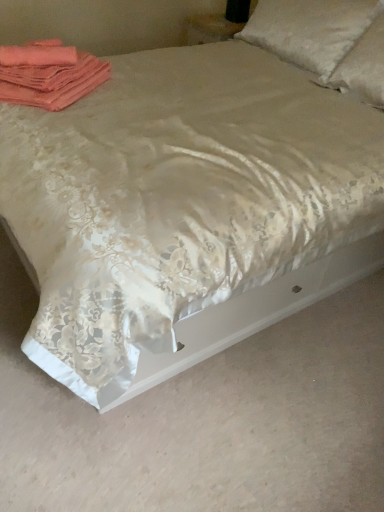
Locate an element on the screen. Image resolution: width=384 pixels, height=512 pixels. white satin pillow at upper right, which is the first pillow in left-to-right order is located at coordinates (310, 30).

In order to click on coral fabric towels at upper left in this screenshot , I will do `click(48, 74)`.

Is satin white pillow at upper right, the first pillow in the right-to-left sequence, positioned with its back to white satin pillow at upper right, which is the first pillow in left-to-right order?

No, white satin pillow at upper right, which is the first pillow in left-to-right order, is not at the back of satin white pillow at upper right, the first pillow in the right-to-left sequence.

From the image's perspective, does satin white pillow at upper right, the 2th pillow from the left, appear lower than white satin pillow at upper right, which is the first pillow in left-to-right order?

Indeed, from the image's perspective, satin white pillow at upper right, the 2th pillow from the left, is shown beneath white satin pillow at upper right, which is the first pillow in left-to-right order.

Is point (352, 89) in front of point (327, 9)?

Yes, it is in front of point (327, 9).

Does satin white pillow at upper right, the 2th pillow from the left, have a greater width compared to white satin pillow at upper right, which is the first pillow in left-to-right order?

Indeed, satin white pillow at upper right, the 2th pillow from the left, has a greater width compared to white satin pillow at upper right, which is the first pillow in left-to-right order.

Between white satin pillow at upper right, the second pillow from the right, and coral fabric towels at upper left, which one appears on the left side from the viewer's perspective?

coral fabric towels at upper left is more to the left.

Is white satin pillow at upper right, which is the first pillow in left-to-right order, located outside coral fabric towels at upper left?

Indeed, white satin pillow at upper right, which is the first pillow in left-to-right order, is completely outside coral fabric towels at upper left.

Looking at this image, who is taller, white satin pillow at upper right, which is the first pillow in left-to-right order, or coral fabric towels at upper left?

Standing taller between the two is white satin pillow at upper right, which is the first pillow in left-to-right order.

Is white satin pillow at upper right, which is the first pillow in left-to-right order, touching coral fabric towels at upper left?

white satin pillow at upper right, which is the first pillow in left-to-right order, and coral fabric towels at upper left are clearly separated.

How many degrees apart are the facing directions of coral fabric towels at upper left and white satin pillow at upper right, which is the first pillow in left-to-right order?

They differ by 52 degrees in their facing directions.

Which is behind, coral fabric towels at upper left or white satin pillow at upper right, which is the first pillow in left-to-right order?

Positioned behind is white satin pillow at upper right, which is the first pillow in left-to-right order.

From the image's perspective, would you say coral fabric towels at upper left is shown under white satin pillow at upper right, which is the first pillow in left-to-right order?

Yes, from the image's perspective, coral fabric towels at upper left is below white satin pillow at upper right, which is the first pillow in left-to-right order.

Is point (20, 65) behind point (289, 53)?

No, (20, 65) is in front of (289, 53).

At what (x,y) coordinates should I click in order to perform the action: click on pillow that is above the satin white pillow at upper right, the first pillow in the right-to-left sequence (from the image's perspective). Please return your answer as a coordinate pair (x, y). Looking at the image, I should click on (310, 30).

Is white satin pillow at upper right, which is the first pillow in left-to-right order, oriented away from satin white pillow at upper right, the 2th pillow from the left?

No.

Could satin white pillow at upper right, the first pillow in the right-to-left sequence, be considered to be inside white satin pillow at upper right, which is the first pillow in left-to-right order?

Yes.

Considering the relative sizes of white satin pillow at upper right, which is the first pillow in left-to-right order, and satin white pillow at upper right, the 2th pillow from the left, in the image provided, is white satin pillow at upper right, which is the first pillow in left-to-right order, taller than satin white pillow at upper right, the 2th pillow from the left,?

No, white satin pillow at upper right, which is the first pillow in left-to-right order, is not taller than satin white pillow at upper right, the 2th pillow from the left.

How many degrees apart are the facing directions of satin white pillow at upper right, the 2th pillow from the left, and coral fabric towels at upper left?

satin white pillow at upper right, the 2th pillow from the left, and coral fabric towels at upper left are facing 52 degrees away from each other.

In the scene shown: Which object is wider, satin white pillow at upper right, the 2th pillow from the left, or coral fabric towels at upper left?

With larger width is satin white pillow at upper right, the 2th pillow from the left.

Which object is closer to the camera taking this photo, satin white pillow at upper right, the first pillow in the right-to-left sequence, or coral fabric towels at upper left?

coral fabric towels at upper left is closer to the camera.

Is satin white pillow at upper right, the first pillow in the right-to-left sequence, aimed at coral fabric towels at upper left?

Yes, satin white pillow at upper right, the first pillow in the right-to-left sequence, is turned towards coral fabric towels at upper left.

Which point is more forward, (99, 74) or (369, 32)?

The point (99, 74) is in front.

Is coral fabric towels at upper left in front of or behind satin white pillow at upper right, the first pillow in the right-to-left sequence, in the image?

Clearly, coral fabric towels at upper left is in front of satin white pillow at upper right, the first pillow in the right-to-left sequence.

Would you say coral fabric towels at upper left is a long distance from satin white pillow at upper right, the 2th pillow from the left?

Yes, coral fabric towels at upper left and satin white pillow at upper right, the 2th pillow from the left, are quite far apart.

Find the location of `pillow above the white satin pillow at upper right, which is the first pillow in left-to-right order (from a real-world perspective)`. pillow above the white satin pillow at upper right, which is the first pillow in left-to-right order (from a real-world perspective) is located at coordinates (363, 66).

You are a GUI agent. You are given a task and a screenshot of the screen. Output one action in this format:
    pyautogui.click(x=<x>, y=<y>)
    Task: Click on the material located on the left of white satin pillow at upper right, the second pillow from the right
    
    Given the screenshot: What is the action you would take?
    pyautogui.click(x=48, y=74)

Looking at the image, which one is located closer to coral fabric towels at upper left, white satin pillow at upper right, the second pillow from the right, or satin white pillow at upper right, the first pillow in the right-to-left sequence?

white satin pillow at upper right, the second pillow from the right, lies closer to coral fabric towels at upper left than the other object.

In the scene shown: Looking at the image, which one is located closer to white satin pillow at upper right, which is the first pillow in left-to-right order, coral fabric towels at upper left or satin white pillow at upper right, the 2th pillow from the left?

satin white pillow at upper right, the 2th pillow from the left, is positioned closer to the anchor white satin pillow at upper right, which is the first pillow in left-to-right order.

Considering their positions, is coral fabric towels at upper left positioned further to satin white pillow at upper right, the first pillow in the right-to-left sequence, than white satin pillow at upper right, which is the first pillow in left-to-right order?

coral fabric towels at upper left is positioned further to the anchor satin white pillow at upper right, the first pillow in the right-to-left sequence.

When comparing their distances from satin white pillow at upper right, the first pillow in the right-to-left sequence, does white satin pillow at upper right, which is the first pillow in left-to-right order, or coral fabric towels at upper left seem closer?

white satin pillow at upper right, which is the first pillow in left-to-right order, lies closer to satin white pillow at upper right, the first pillow in the right-to-left sequence, than the other object.

Consider the image. Which object lies nearer to the anchor point coral fabric towels at upper left, satin white pillow at upper right, the 2th pillow from the left, or white satin pillow at upper right, which is the first pillow in left-to-right order?

white satin pillow at upper right, which is the first pillow in left-to-right order, is closer to coral fabric towels at upper left.

From the image, which object appears to be nearer to white satin pillow at upper right, which is the first pillow in left-to-right order, satin white pillow at upper right, the first pillow in the right-to-left sequence, or coral fabric towels at upper left?

satin white pillow at upper right, the first pillow in the right-to-left sequence, lies closer to white satin pillow at upper right, which is the first pillow in left-to-right order, than the other object.

This screenshot has height=512, width=384. Find the location of `pillow between coral fabric towels at upper left and satin white pillow at upper right, the 2th pillow from the left, in the horizontal direction`. pillow between coral fabric towels at upper left and satin white pillow at upper right, the 2th pillow from the left, in the horizontal direction is located at coordinates (310, 30).